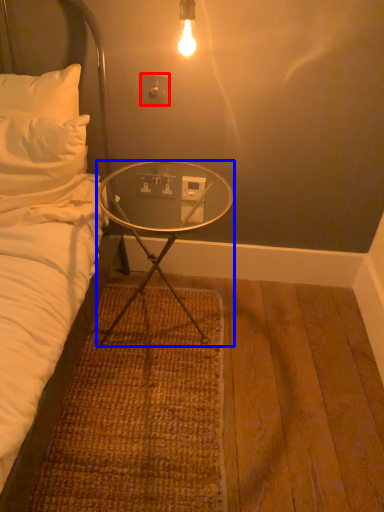
Question: Which point is further to the camera, electric outlet (highlighted by a red box) or desk (highlighted by a blue box)?

Choices:
 (A) electric outlet
 (B) desk

Answer: (A)